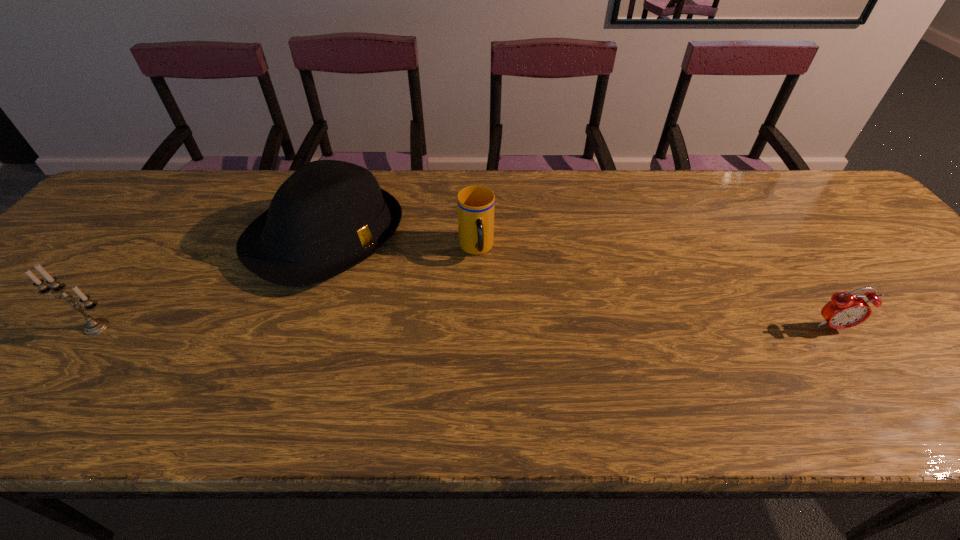
Where is `unoccupied area between the cup and the candle`? This screenshot has width=960, height=540. unoccupied area between the cup and the candle is located at coordinates (286, 288).

Choose which object is the nearest neighbor to the rightmost object. Please provide its 2D coordinates. Your answer should be formatted as a tuple, i.e. [(x, y)], where the tuple contains the x and y coordinates of a point satisfying the conditions above.

[(475, 204)]

Where is `object that is the third closest one to the shortest object`? Image resolution: width=960 pixels, height=540 pixels. object that is the third closest one to the shortest object is located at coordinates (94, 326).

The width and height of the screenshot is (960, 540). Identify the location of vacant space that satisfies the following two spatial constraints: 1. on the back side of the leftmost object; 2. on the right side of the cup. click(156, 249).

The width and height of the screenshot is (960, 540). Find the location of `free space that satisfies the following two spatial constraints: 1. on the back side of the cup; 2. on the left side of the leftmost object`. free space that satisfies the following two spatial constraints: 1. on the back side of the cup; 2. on the left side of the leftmost object is located at coordinates (156, 249).

I want to click on free spot that satisfies the following two spatial constraints: 1. on the back side of the third object from right to left; 2. on the left side of the candle, so click(164, 238).

Locate an element on the screen. This screenshot has width=960, height=540. free space that satisfies the following two spatial constraints: 1. on the back side of the fedora; 2. on the right side of the leftmost object is located at coordinates (164, 238).